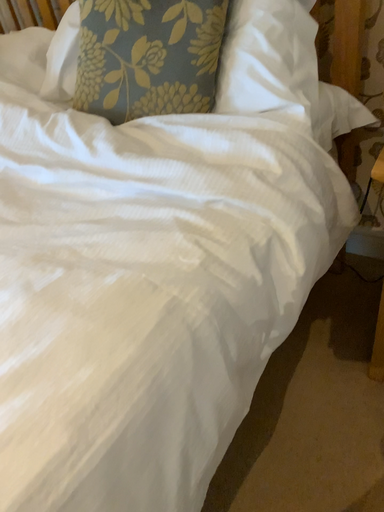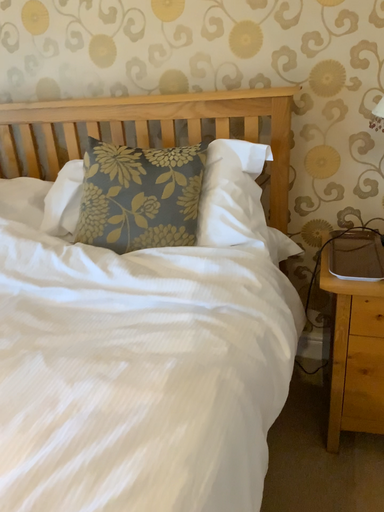
Question: Which way did the camera rotate in the video?

Choices:
 (A) rotated left
 (B) rotated right

Answer: (B)